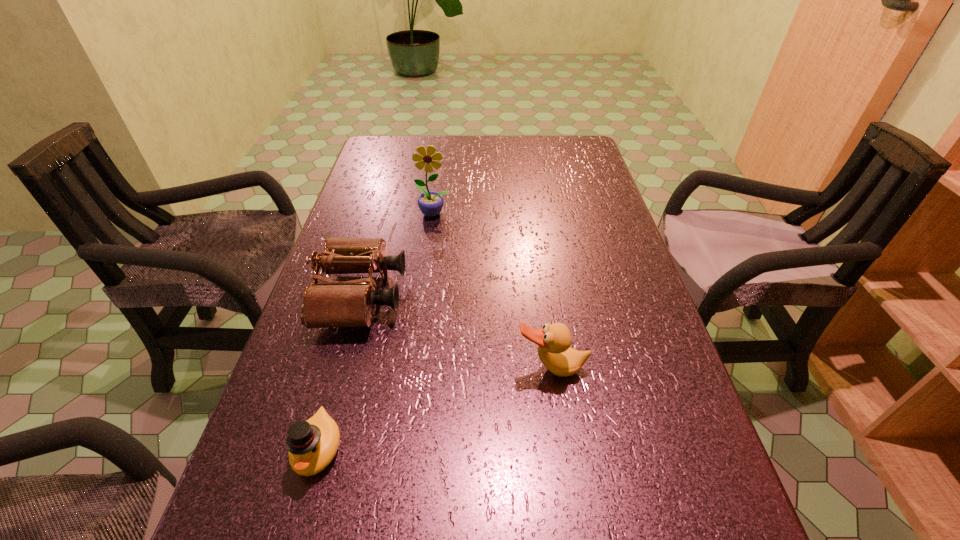
Where is `free location located on the front-facing side of the shortest object`? free location located on the front-facing side of the shortest object is located at coordinates (299, 519).

Identify the location of binoculars present at the left edge. The height and width of the screenshot is (540, 960). (350, 303).

Locate an element on the screen. duck that is at the left edge is located at coordinates point(312,444).

Where is `vacant space at the far edge of the desktop`? vacant space at the far edge of the desktop is located at coordinates (485, 144).

Identify the location of free region at the left edge of the desktop. Image resolution: width=960 pixels, height=540 pixels. (366, 360).

Where is `vacant space at the right edge of the desktop`? The image size is (960, 540). vacant space at the right edge of the desktop is located at coordinates (690, 399).

At what (x,y) coordinates should I click in order to perform the action: click on free spot at the far left corner of the desktop. Please return your answer as a coordinate pair (x, y). Looking at the image, I should click on (393, 144).

Identify the location of vacant region at the far right corner of the desktop. Image resolution: width=960 pixels, height=540 pixels. click(x=562, y=146).

This screenshot has width=960, height=540. Identify the location of vacant area that lies between the farther duck and the shortest object. (435, 409).

What are the coordinates of `free space between the tallest object and the left duck` in the screenshot? It's located at (376, 332).